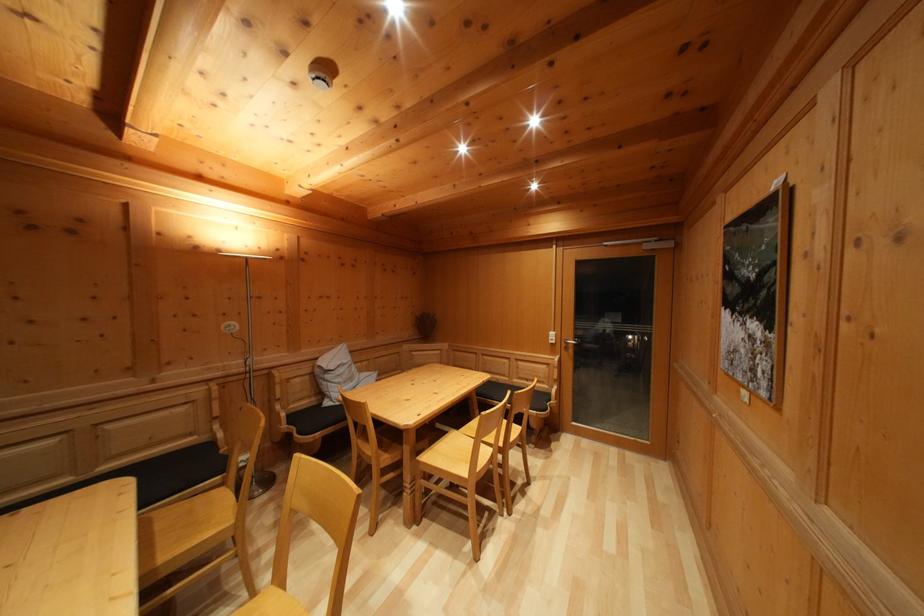
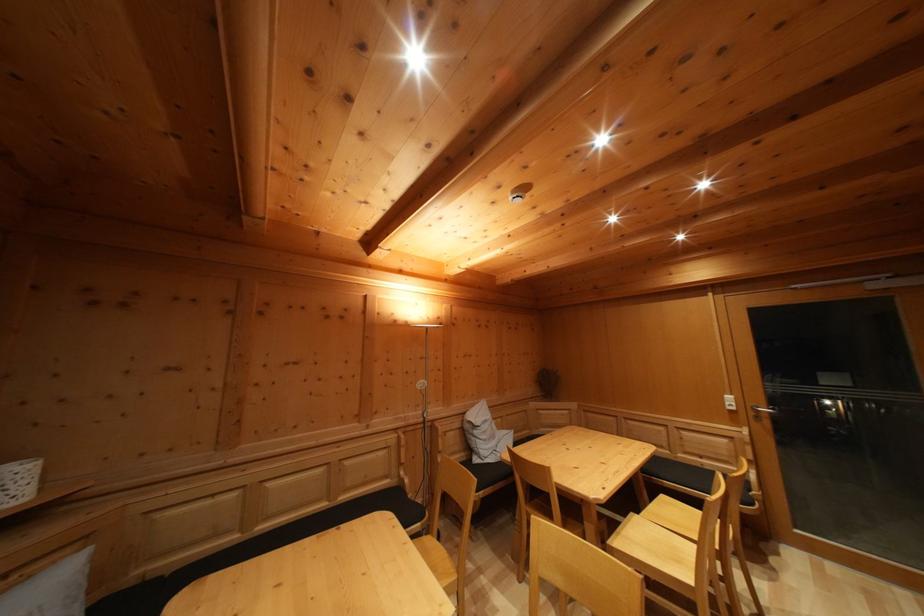
Question: How did the camera likely rotate?

Choices:
 (A) Left
 (B) Right
 (C) Up
 (D) Down

Answer: (A)